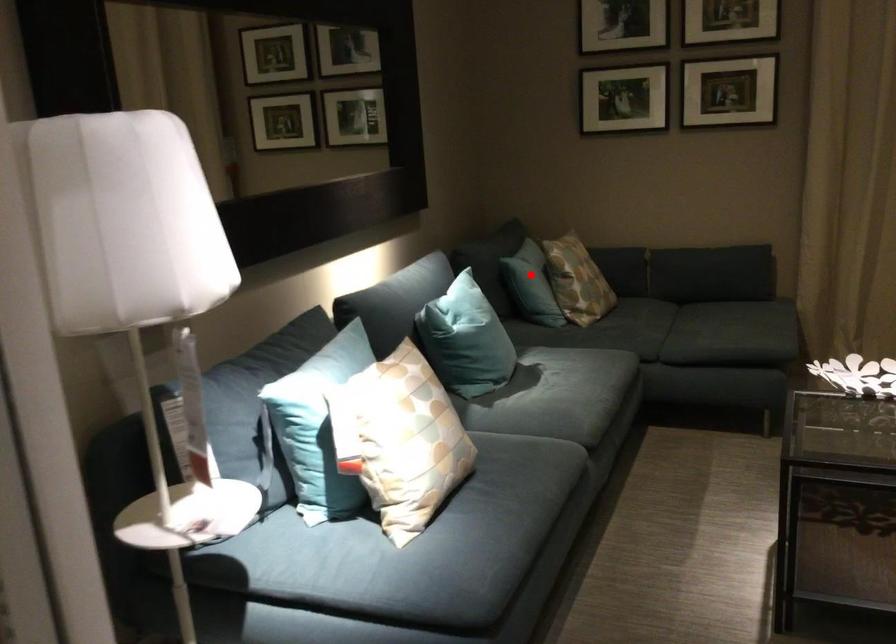
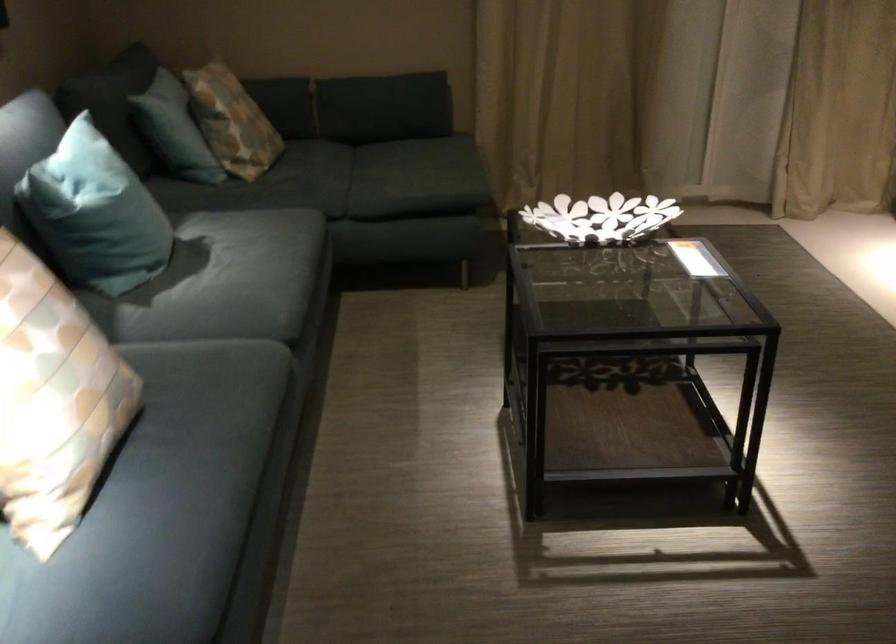
In the second image, find the point that corresponds to the highlighted location in the first image.

(174, 129)